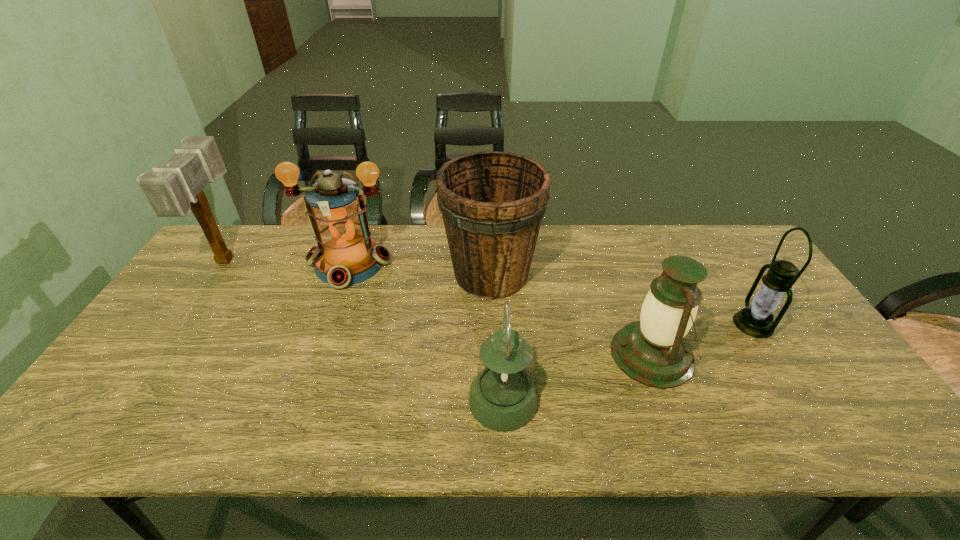
The height and width of the screenshot is (540, 960). Find the location of `object at the near edge`. object at the near edge is located at coordinates (503, 397).

The width and height of the screenshot is (960, 540). I want to click on object at the left edge, so click(x=174, y=189).

In order to click on object that is at the right edge in this screenshot , I will do `click(756, 320)`.

Image resolution: width=960 pixels, height=540 pixels. What are the coordinates of `object that is at the far left corner` in the screenshot? It's located at (174, 189).

The image size is (960, 540). Find the location of `free space at the far edge of the desktop`. free space at the far edge of the desktop is located at coordinates (283, 242).

I want to click on vacant space at the near edge, so click(x=439, y=427).

At what (x,y) coordinates should I click in order to perform the action: click on vacant area that lies between the third lantern from left to right and the leftmost lantern. Please return your answer as a coordinate pair (x, y). Looking at the image, I should click on (501, 309).

Where is `free point between the leftmost lantern and the bucket`? free point between the leftmost lantern and the bucket is located at coordinates (420, 269).

The height and width of the screenshot is (540, 960). What are the coordinates of `free spot between the leftmost lantern and the second lantern from left to right` in the screenshot? It's located at (426, 332).

Where is `unoccupied area between the bucket and the rightmost object`? The image size is (960, 540). unoccupied area between the bucket and the rightmost object is located at coordinates (622, 299).